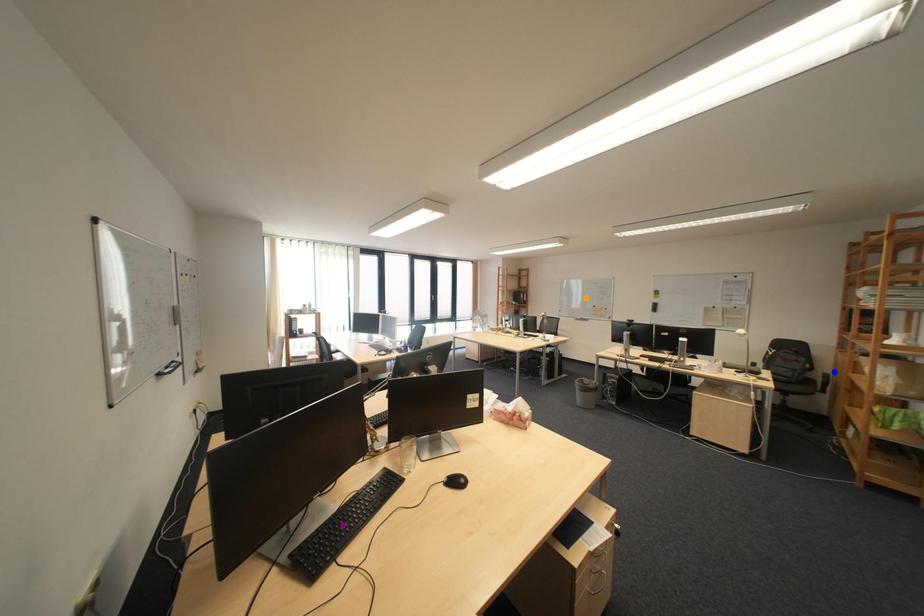
Order these from nearest to farthest:
A) purple point
B) blue point
C) orange point

1. purple point
2. blue point
3. orange point